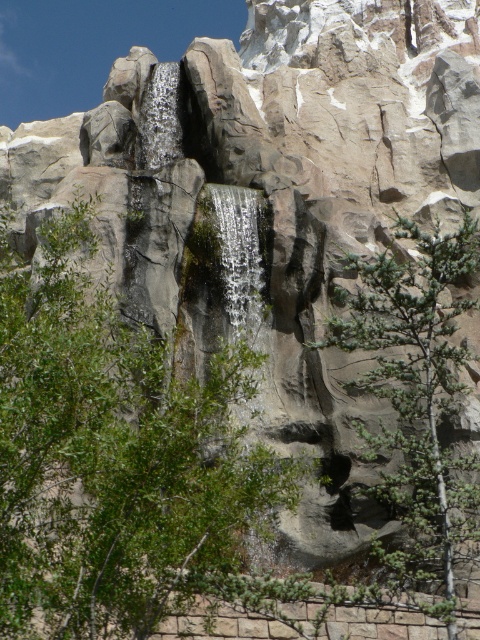
Is green leafy tree at center taller than green textured tree at center?

In fact, green leafy tree at center may be shorter than green textured tree at center.

The width and height of the screenshot is (480, 640). What are the coordinates of `green leafy tree at center` in the screenshot? It's located at (115, 456).

Does point (88, 492) lie in front of point (409, 561)?

Yes, it is in front of point (409, 561).

The height and width of the screenshot is (640, 480). Identify the location of green leafy tree at center. click(115, 456).